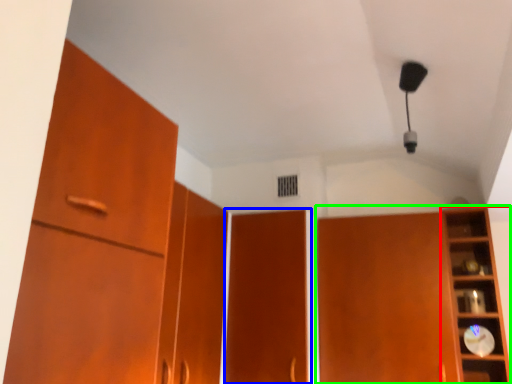
Question: Based on their relative distances, which object is farther from shelf (highlighted by a red box)? Choose from door (highlighted by a blue box) and cupboard (highlighted by a green box).

Choices:
 (A) door
 (B) cupboard

Answer: (A)